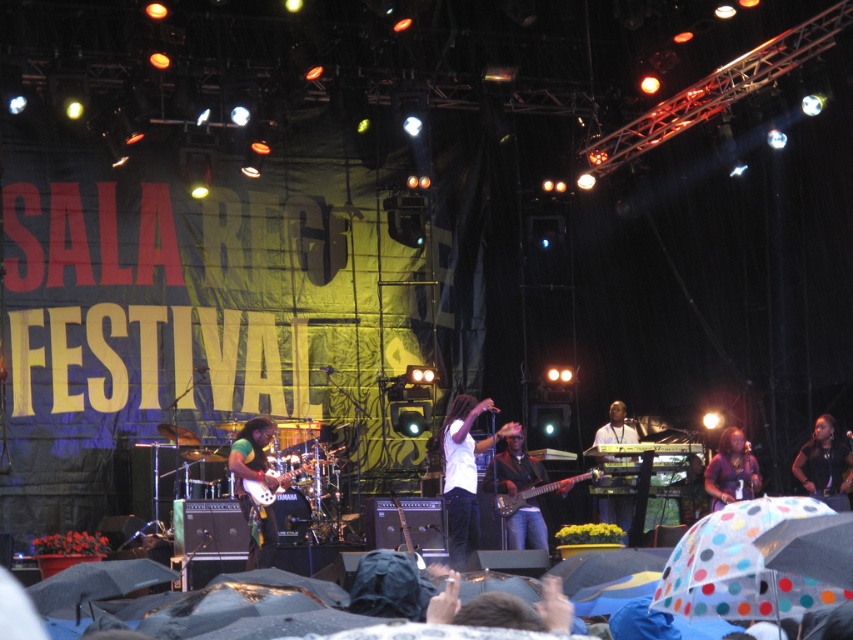
You are a photographer trying to capture a clear shot of the white matte shirt at center and the white glossy keyboard at center during the concert. Since both are white, you need to adjust your camera settings to differentiate them based on their height. Which object should you focus on first to ensure it appears larger in the photo?

The white matte shirt at center is much taller than the white glossy keyboard at center, so focusing on the white matte shirt at center first will ensure it appears larger in the photo.

You are a photographer trying to capture the band members on stage during the concert. You notice two points marked on your camera screen at coordinates point (454, 522) and point (611, 515). Which point should you focus on to get a clearer image of the drummer who is closer to the front of the stage?

Point (454, 522) should be focused on because it is in front of point (611, 515), aligning with the drummer who is closer to the front of the stage.

You are at the concert and want to take a photo of the banner. The banner is located at the point marked by coordinates point [821,458]. If your camera has a maximum focus range of 70 feet, will you be able to focus on the banner from your current position?

The point [821,458] is 75.40 feet away from the viewer. Since the camera can only focus up to 70 feet, you won not be able to focus on the banner from your current position.